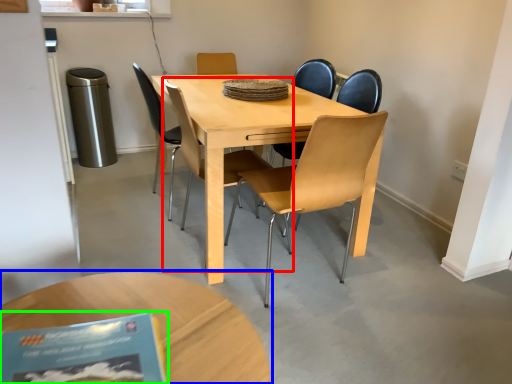
Question: Based on their relative distances, which object is nearer to chair (highlighted by a red box)? Choose from coffee table (highlighted by a blue box) and book (highlighted by a green box).

Choices:
 (A) coffee table
 (B) book

Answer: (A)